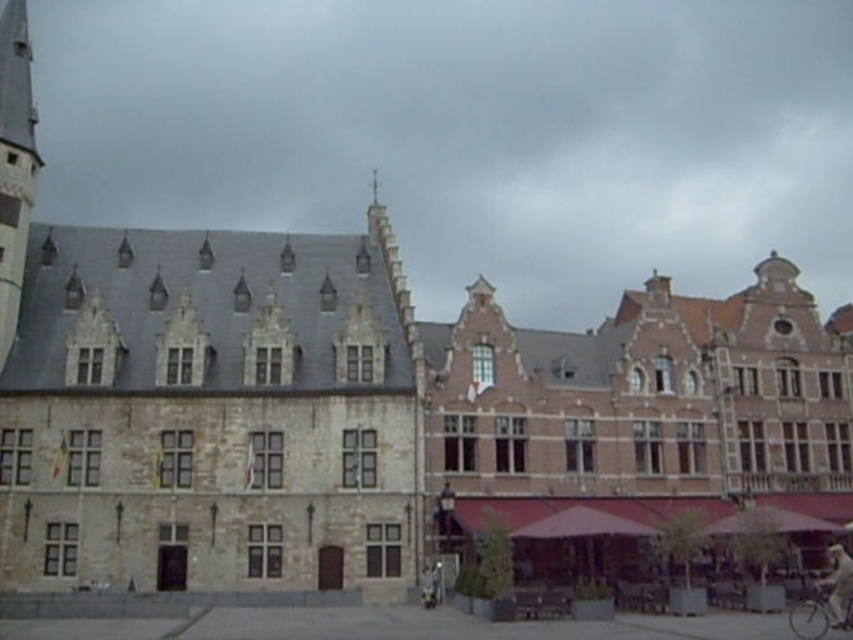
Is point (846, 598) closer to viewer compared to point (831, 616)?

Yes, it is in front of point (831, 616).

The height and width of the screenshot is (640, 853). I want to click on silver metallic bicycle at lower right, so click(x=820, y=611).

This screenshot has height=640, width=853. I want to click on silver metallic bicycle at lower right, so click(x=820, y=611).